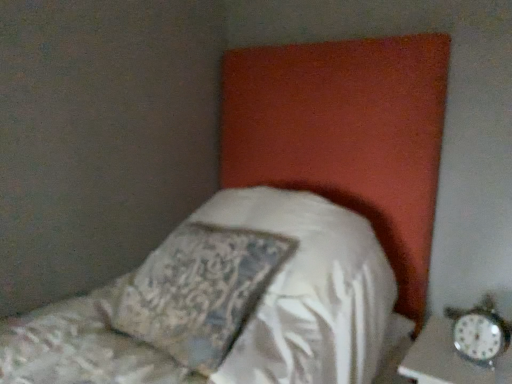
Question: Does metallic silver alarm clock at lower right have a lesser height compared to silky white pillow at center?

Choices:
 (A) yes
 (B) no

Answer: (A)

Question: Can you confirm if metallic silver alarm clock at lower right is wider than silky white pillow at center?

Choices:
 (A) yes
 (B) no

Answer: (B)

Question: Is metallic silver alarm clock at lower right behind silky white pillow at center?

Choices:
 (A) yes
 (B) no

Answer: (A)

Question: Is metallic silver alarm clock at lower right not close to silky white pillow at center?

Choices:
 (A) yes
 (B) no

Answer: (B)

Question: Does metallic silver alarm clock at lower right have a lesser width compared to silky white pillow at center?

Choices:
 (A) yes
 (B) no

Answer: (A)

Question: Is metallic silver alarm clock at lower right touching silky white pillow at center?

Choices:
 (A) yes
 (B) no

Answer: (B)

Question: Is silky white pillow at center in contact with metallic silver alarm clock at lower right?

Choices:
 (A) yes
 (B) no

Answer: (B)

Question: Considering the relative positions of silky white pillow at center and metallic silver alarm clock at lower right in the image provided, is silky white pillow at center in front of metallic silver alarm clock at lower right?

Choices:
 (A) yes
 (B) no

Answer: (A)

Question: From the image's perspective, is silky white pillow at center below metallic silver alarm clock at lower right?

Choices:
 (A) no
 (B) yes

Answer: (A)

Question: Is metallic silver alarm clock at lower right a part of silky white pillow at center?

Choices:
 (A) no
 (B) yes

Answer: (A)

Question: Is silky white pillow at center taller than metallic silver alarm clock at lower right?

Choices:
 (A) yes
 (B) no

Answer: (A)

Question: Does silky white pillow at center have a lesser height compared to metallic silver alarm clock at lower right?

Choices:
 (A) no
 (B) yes

Answer: (A)

Question: Considering the positions of point (505, 337) and point (241, 246), is point (505, 337) closer or farther from the camera than point (241, 246)?

Choices:
 (A) farther
 (B) closer

Answer: (B)